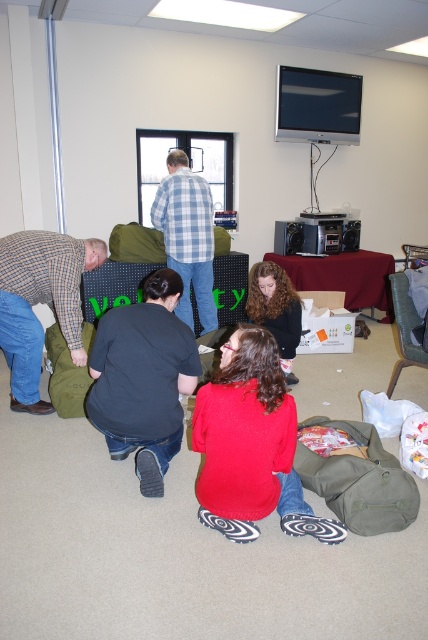
Can you confirm if black cotton shirt at lower center is positioned above blue plaid shirt at center?

No, black cotton shirt at lower center is not above blue plaid shirt at center.

Who is more forward, (154, 445) or (160, 193)?

Positioned in front is point (154, 445).

Between point (115, 365) and point (184, 176), which one is positioned behind?

Point (184, 176)

The height and width of the screenshot is (640, 428). What are the coordinates of `black cotton shirt at lower center` in the screenshot? It's located at (143, 378).

Is black cotton shirt at lower center below curly hair at lower center?

Yes, black cotton shirt at lower center is below curly hair at lower center.

Between point (160, 380) and point (285, 292), which one is positioned in front?

Positioned in front is point (160, 380).

Where is `black cotton shirt at lower center`? The image size is (428, 640). black cotton shirt at lower center is located at coordinates (143, 378).

Does point (33, 381) come farther from viewer compared to point (186, 192)?

No, it is not.

Between plaid wool sweater at left and blue plaid shirt at center, which one has less height?

plaid wool sweater at left is shorter.

This screenshot has width=428, height=640. Identify the location of plaid wool sweater at left. (41, 301).

Where is `plaid wool sweater at left`? plaid wool sweater at left is located at coordinates (41, 301).